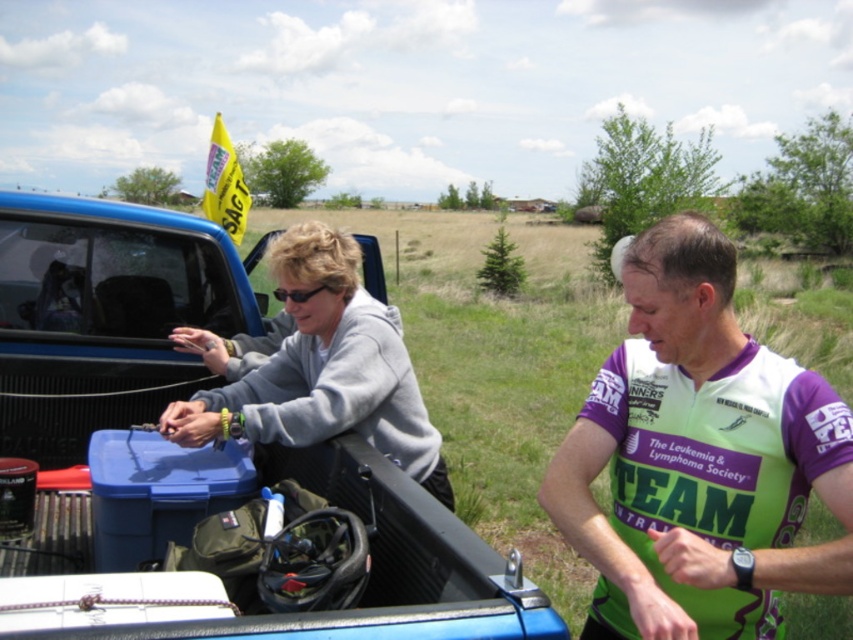
Question: Can you confirm if green jersey at right is bigger than gray fleece jacket at upper left?

Choices:
 (A) no
 (B) yes

Answer: (B)

Question: Does blue matte truck bed at center appear under gray matte jacket at upper left?

Choices:
 (A) yes
 (B) no

Answer: (A)

Question: Which object is farther from the camera taking this photo?

Choices:
 (A) blue matte truck bed at center
 (B) green jersey at right

Answer: (B)

Question: Is blue matte truck bed at center to the right of gray matte jacket at upper left from the viewer's perspective?

Choices:
 (A) no
 (B) yes

Answer: (A)

Question: Which of these objects is positioned closest to the blue matte truck bed at center?

Choices:
 (A) green jersey at right
 (B) gray matte jacket at upper left
 (C) gray fleece jacket at upper left

Answer: (B)

Question: Which point appears closest to the camera in this image?

Choices:
 (A) (672, 346)
 (B) (643, 243)

Answer: (A)